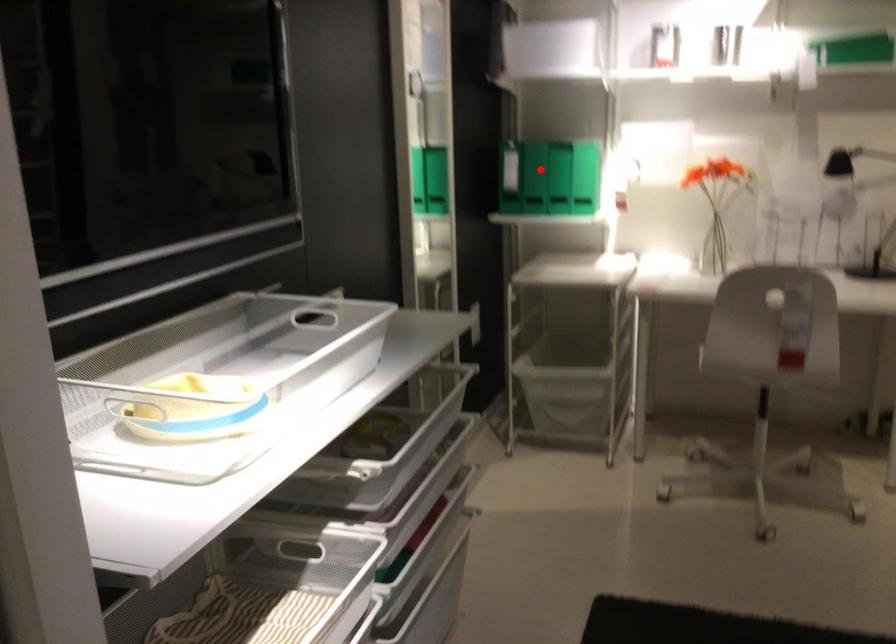
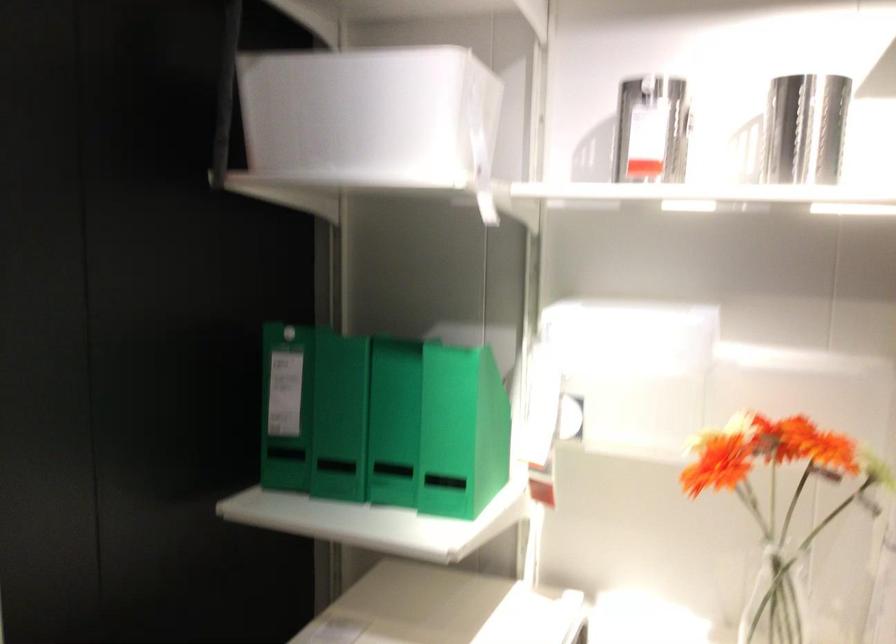
Question: I am providing you with two images of the same scene from different viewpoints. Given a red point in image1, look at the same physical point in image2. Is it:

Choices:
 (A) Closer to the viewpoint
 (B) Farther from the viewpoint

Answer: (A)